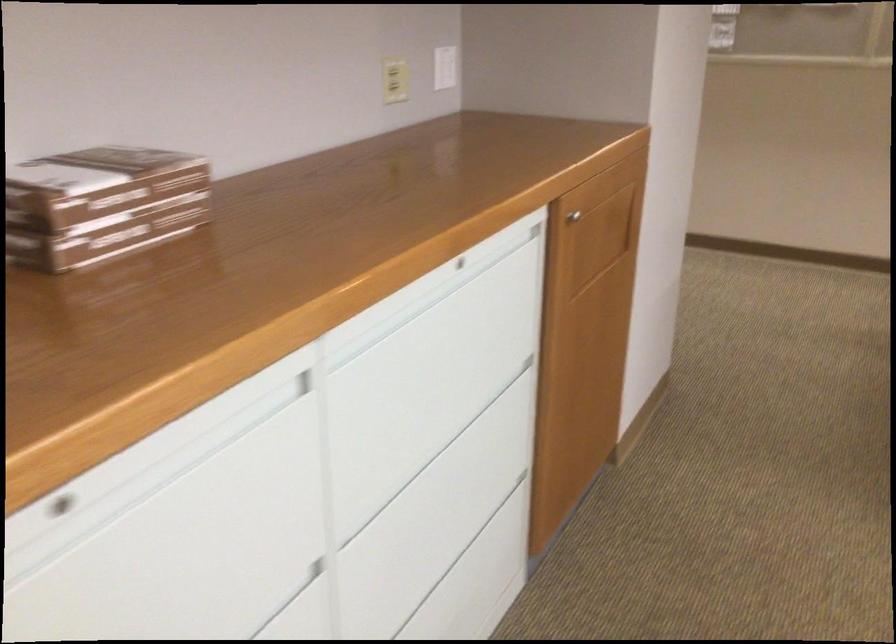
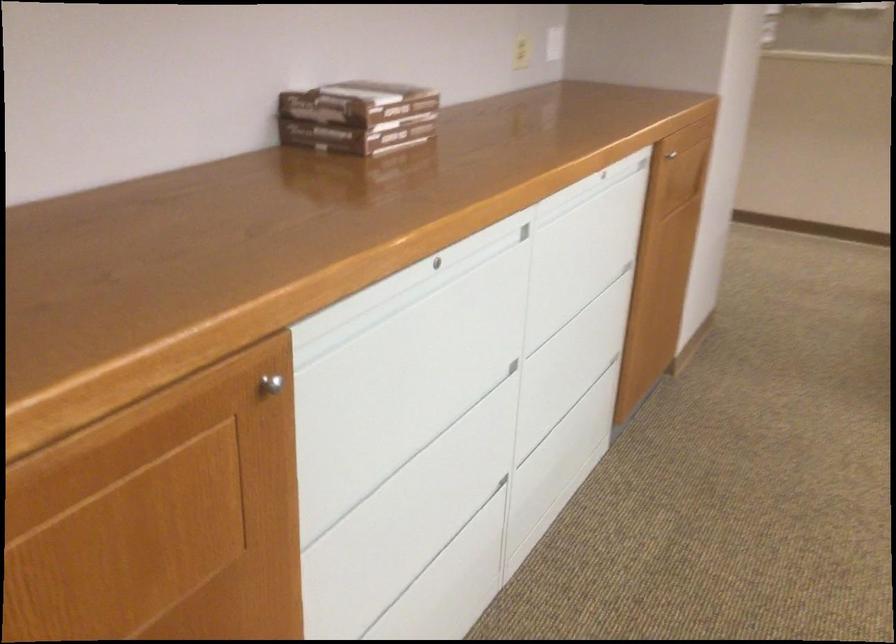
Find the pixel in the second image that matches [582,221] in the first image.

(675, 156)